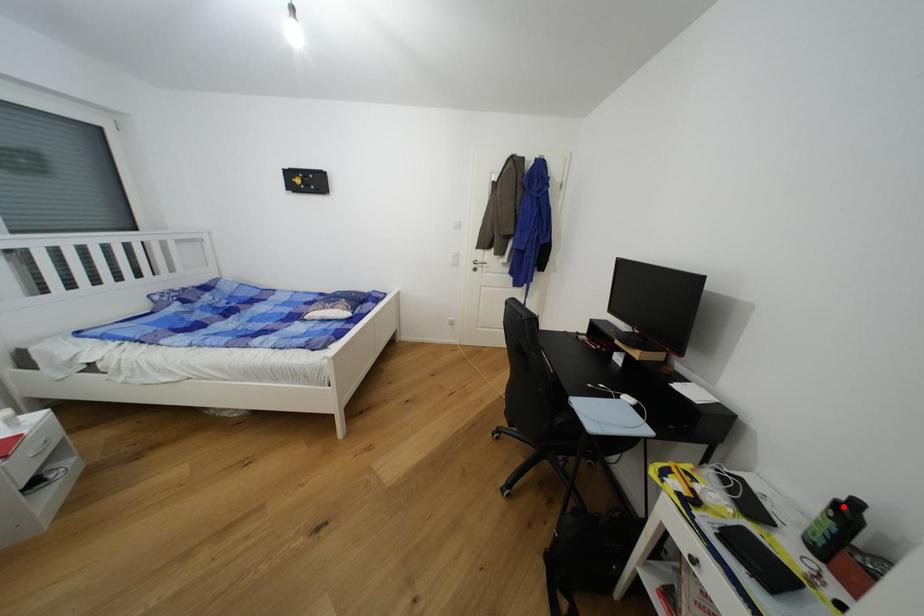
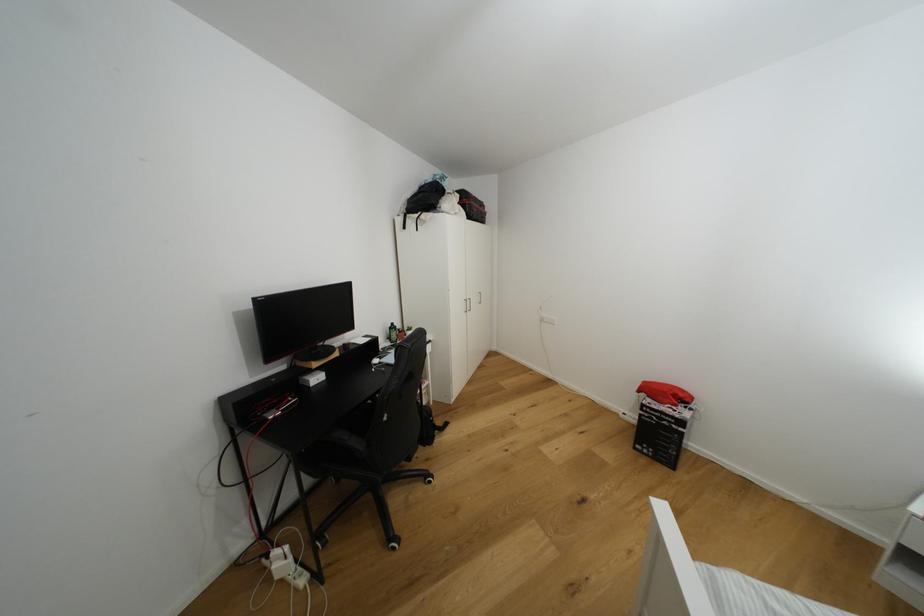
Find the pixel in the second image that matches the highlighted location in the first image.

(395, 330)